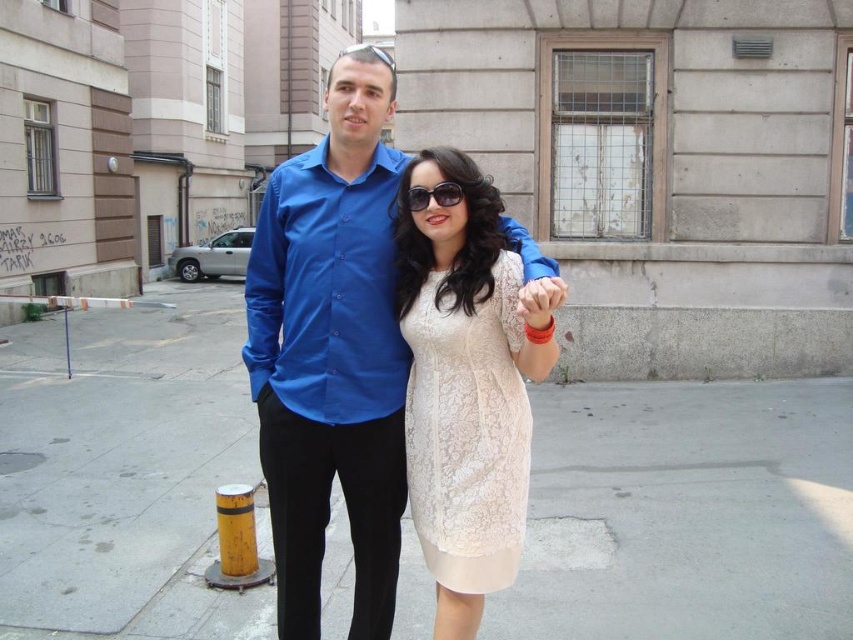
You are a delivery robot navigating a busy street. You need to drop off a package at the gray concrete pavement at center. There is a point marked at coordinates point (686, 513). Is this point the correct location for the drop off?

The point (686, 513) is on gray concrete pavement at center, so yes, this is the correct location for the drop off.

You are a photographer trying to capture a closeup of the lace fabric dress at center while standing behind the gray concrete pavement at center. Can you do this without moving either object?

The gray concrete pavement at center is closer to you than the lace fabric dress at center, so you cannot take a closeup of the lace fabric dress at center without moving the gray concrete pavement at center out of the way.

You are a photographer standing behind the two people in the image. You want to place a small tripod on the gray concrete pavement at center without blocking the view of the blue cotton shirt at center. Is this possible?

The gray concrete pavement at center is located below the blue cotton shirt at center, so placing a small tripod on the gray concrete pavement at center would not block the view of the blue cotton shirt at center as long as it is positioned appropriately.